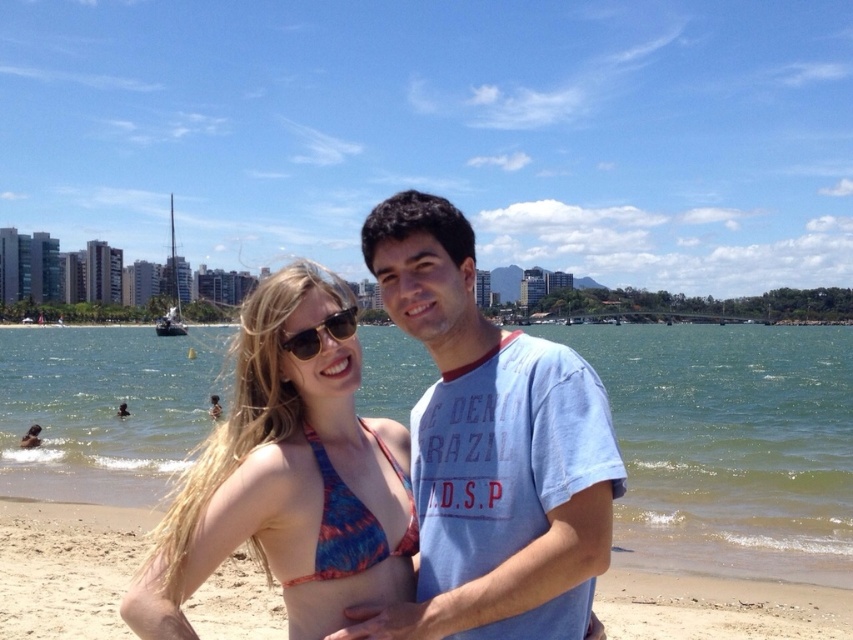
Question: Does multicolored bikini top at center have a smaller size compared to beige sand at center?

Choices:
 (A) no
 (B) yes

Answer: (A)

Question: Which point is farther to the camera?

Choices:
 (A) multicolored bikini top at center
 (B) blue water at center

Answer: (B)

Question: Among these objects, which one is farthest from the camera?

Choices:
 (A) blue printed bikini top at center
 (B) blue water at center
 (C) sunglasses at center
 (D) multicolored bikini top at center

Answer: (B)

Question: Can you confirm if beige sand at center is positioned to the left of blue printed bikini top at center?

Choices:
 (A) yes
 (B) no

Answer: (A)

Question: Can you confirm if light blue cotton t-shirt at center is thinner than beige sand at center?

Choices:
 (A) no
 (B) yes

Answer: (B)

Question: Which object appears closest to the camera in this image?

Choices:
 (A) blue water at center
 (B) light blue cotton t-shirt at center
 (C) multicolored bikini top at center

Answer: (C)